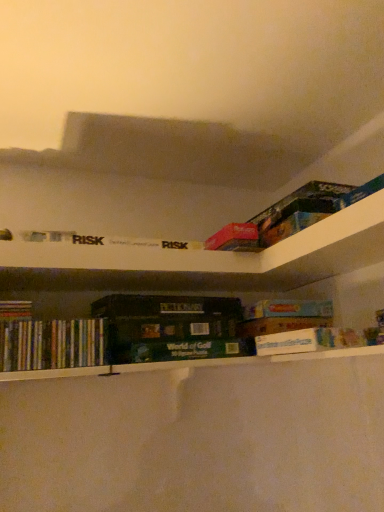
Question: Does white cardboard box at center, which appears as the first book when viewed from the right, touch hardcover dictionary at center?

Choices:
 (A) no
 (B) yes

Answer: (A)

Question: Is white cardboard box at center, the second book when ordered from left to right, aimed at hardcover dictionary at center?

Choices:
 (A) yes
 (B) no

Answer: (B)

Question: From the image's perspective, is white cardboard box at center, which appears as the first book when viewed from the right, located above hardcover dictionary at center?

Choices:
 (A) no
 (B) yes

Answer: (A)

Question: Is white cardboard box at center, the second book when ordered from left to right, bigger than hardcover dictionary at center?

Choices:
 (A) no
 (B) yes

Answer: (A)

Question: Considering the relative sizes of white cardboard box at center, the second book when ordered from left to right, and hardcover dictionary at center in the image provided, is white cardboard box at center, the second book when ordered from left to right, wider than hardcover dictionary at center?

Choices:
 (A) yes
 (B) no

Answer: (A)

Question: Is white cardboard box at center, the second book when ordered from left to right, shorter than hardcover dictionary at center?

Choices:
 (A) no
 (B) yes

Answer: (A)

Question: Is hardcover dictionary at center far away from multicolored paperbacks at lower left, the second book when ordered from right to left?

Choices:
 (A) no
 (B) yes

Answer: (A)

Question: Is hardcover dictionary at center located outside multicolored paperbacks at lower left, the second book when ordered from right to left?

Choices:
 (A) yes
 (B) no

Answer: (A)

Question: Is hardcover dictionary at center closer to camera compared to multicolored paperbacks at lower left, which is counted as the first book, starting from the left?

Choices:
 (A) no
 (B) yes

Answer: (A)

Question: Is hardcover dictionary at center oriented towards multicolored paperbacks at lower left, the second book when ordered from right to left?

Choices:
 (A) no
 (B) yes

Answer: (A)

Question: Considering the relative sizes of hardcover dictionary at center and multicolored paperbacks at lower left, the second book when ordered from right to left, in the image provided, is hardcover dictionary at center bigger than multicolored paperbacks at lower left, the second book when ordered from right to left,?

Choices:
 (A) no
 (B) yes

Answer: (B)

Question: From the image's perspective, is hardcover dictionary at center on top of multicolored paperbacks at lower left, which is counted as the first book, starting from the left?

Choices:
 (A) no
 (B) yes

Answer: (B)

Question: Is multicolored paperbacks at lower left, the second book when ordered from right to left, far away from hardcover dictionary at center?

Choices:
 (A) no
 (B) yes

Answer: (A)